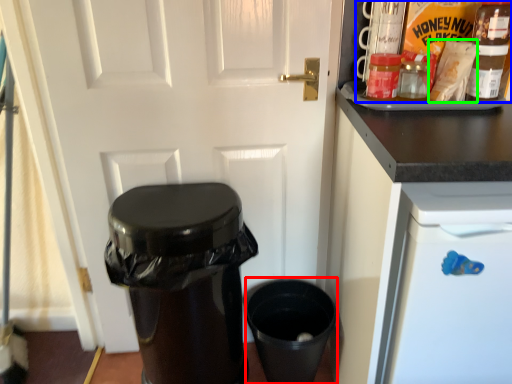
Question: Which is farther away from appliance (highlighted by a red box)? food (highlighted by a blue box) or food (highlighted by a green box)?

Choices:
 (A) food
 (B) food

Answer: (A)